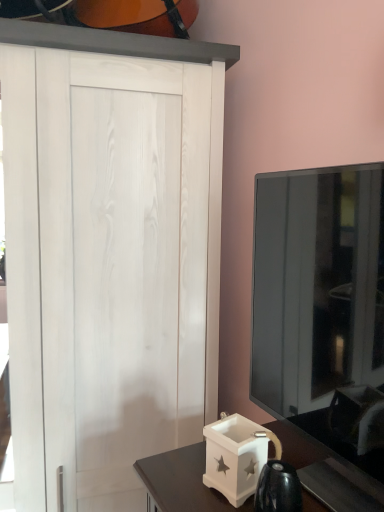
Question: Is white matte box at lower right wider or thinner than transparent glass tv at right?

Choices:
 (A) thin
 (B) wide

Answer: (A)

Question: Relative to transparent glass tv at right, is white matte box at lower right in front or behind?

Choices:
 (A) front
 (B) behind

Answer: (B)

Question: Visually, is white matte box at lower right positioned to the left or to the right of transparent glass tv at right?

Choices:
 (A) left
 (B) right

Answer: (A)

Question: Is transparent glass tv at right in front of or behind white matte box at lower right in the image?

Choices:
 (A) behind
 (B) front

Answer: (B)

Question: Based on their positions, is transparent glass tv at right located to the left or right of white matte box at lower right?

Choices:
 (A) right
 (B) left

Answer: (A)

Question: Looking at their shapes, would you say transparent glass tv at right is wider or thinner than white matte box at lower right?

Choices:
 (A) thin
 (B) wide

Answer: (B)

Question: From a real-world perspective, relative to white matte box at lower right, is transparent glass tv at right vertically above or below?

Choices:
 (A) below
 (B) above

Answer: (B)